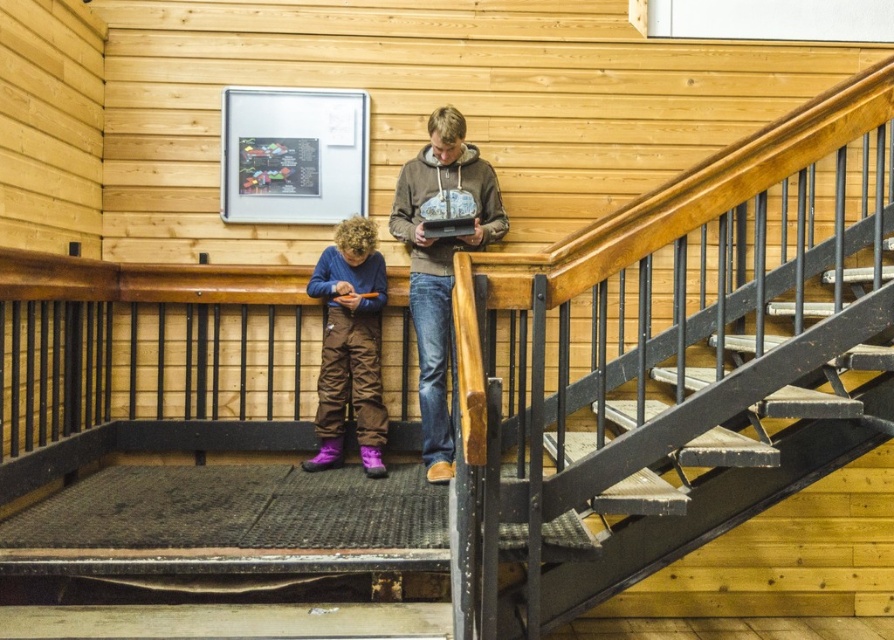
Question: Is matte brown hoodie at center above purple quilted snowsuit at center?

Choices:
 (A) no
 (B) yes

Answer: (B)

Question: Does matte brown hoodie at center have a larger size compared to purple quilted snowsuit at center?

Choices:
 (A) yes
 (B) no

Answer: (A)

Question: Which object is closer to the camera taking this photo?

Choices:
 (A) purple quilted snowsuit at center
 (B) matte brown hoodie at center

Answer: (B)

Question: Which object is closer to the camera taking this photo?

Choices:
 (A) matte brown hoodie at center
 (B) purple quilted snowsuit at center

Answer: (A)

Question: Is matte brown hoodie at center bigger than purple quilted snowsuit at center?

Choices:
 (A) yes
 (B) no

Answer: (A)